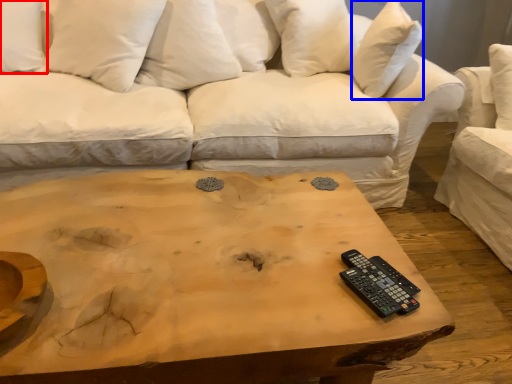
Question: Among these objects, which one is nearest to the camera, pillow (highlighted by a red box) or pillow (highlighted by a blue box)?

Choices:
 (A) pillow
 (B) pillow

Answer: (A)